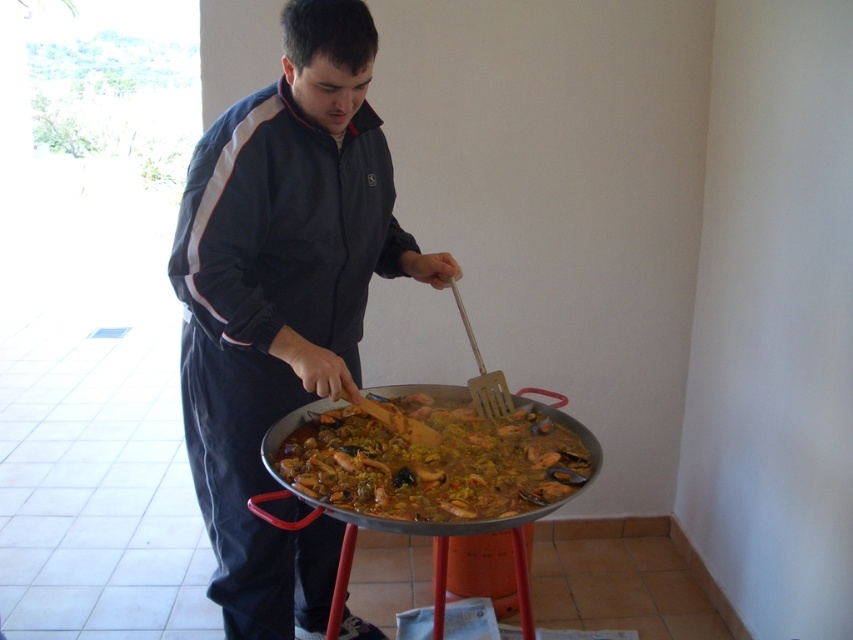
Question: Can you confirm if dark blue track suit at center is smaller than yellow rice at center?

Choices:
 (A) yes
 (B) no

Answer: (B)

Question: Can you confirm if dark blue track suit at center is thinner than yellow rice at center?

Choices:
 (A) no
 (B) yes

Answer: (B)

Question: Among these objects, which one is farthest from the camera?

Choices:
 (A) yellow rice at center
 (B) dark blue track suit at center

Answer: (B)

Question: Which object is closer to the camera taking this photo?

Choices:
 (A) dark blue track suit at center
 (B) yellow rice at center

Answer: (B)

Question: Does dark blue track suit at center appear on the right side of yellow rice at center?

Choices:
 (A) no
 (B) yes

Answer: (A)

Question: Which point is farther from the camera taking this photo?

Choices:
 (A) (459, 403)
 (B) (310, 12)

Answer: (A)